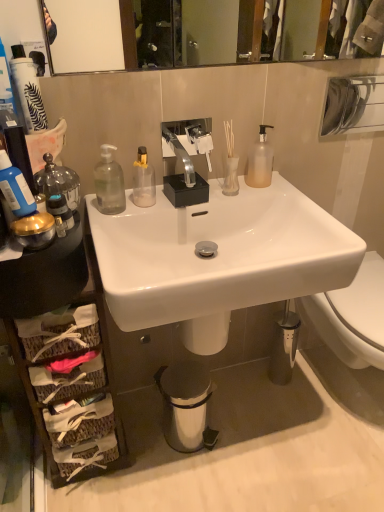
Question: Considering the positions of point (18, 167) and point (223, 184), is point (18, 167) closer or farther from the camera than point (223, 184)?

Choices:
 (A) farther
 (B) closer

Answer: (B)

Question: Is blue matte bottle at left, which is the first bottle from front to back, to the left or to the right of translucent glass vase at upper center in the image?

Choices:
 (A) right
 (B) left

Answer: (B)

Question: Which object is the closest to the white frosted glass vase at upper center?

Choices:
 (A) translucent glass vase at upper center
 (B) blue matte bottle at left, which ranks as the 3th bottle in back-to-front order
 (C) white glossy sink at center, which is the 2th sink from top to bottom
 (D) transparent plastic bottle at left, which is the 2th bottle in front-to-back order
 (E) polished chrome faucet at center, which is the first sink in top-to-bottom order

Answer: (A)

Question: Which is farther from the frosted glass pump bottle at upper right, which ranks as the first bottle in right-to-left order?

Choices:
 (A) metallic trash can at lower center
 (B) white frosted glass vase at upper center
 (C) blue matte bottle at left, which is the first bottle from front to back
 (D) transparent plastic bottle at left, which is the second bottle in right-to-left order
 (E) polished chrome faucet at center, which is the first sink in top-to-bottom order

Answer: (A)